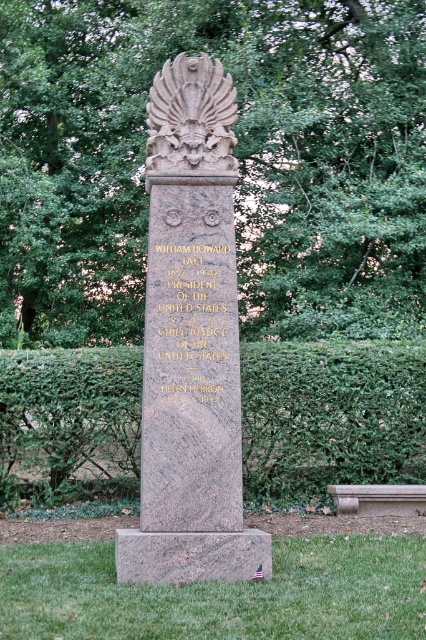
Describe the element at coordinates (190, 342) in the screenshot. I see `polished granite monument at center` at that location.

Does polished granite monument at center have a greater height compared to carved stone eagle at center?

Correct, polished granite monument at center is much taller as carved stone eagle at center.

At what (x,y) coordinates should I click in order to perform the action: click on polished granite monument at center. Please return your answer as a coordinate pair (x, y). Looking at the image, I should click on (190, 342).

Does green leafy tree at center appear under smooth gray stone bench at lower right?

No, green leafy tree at center is not below smooth gray stone bench at lower right.

Is green leafy tree at center to the left of smooth gray stone bench at lower right from the viewer's perspective?

Indeed, green leafy tree at center is positioned on the left side of smooth gray stone bench at lower right.

Between point (123, 304) and point (417, 497), which one is positioned in front?

Point (417, 497)

The width and height of the screenshot is (426, 640). I want to click on green leafy tree at center, so click(x=236, y=154).

Is green leafy hedge at center positioned in front of smooth gray stone bench at lower right?

That is False.

Who is positioned more to the left, green leafy hedge at center or smooth gray stone bench at lower right?

green leafy hedge at center

Is point (322, 388) less distant than point (400, 484)?

No, it is behind (400, 484).

Find the location of a particular element. green leafy hedge at center is located at coordinates (331, 416).